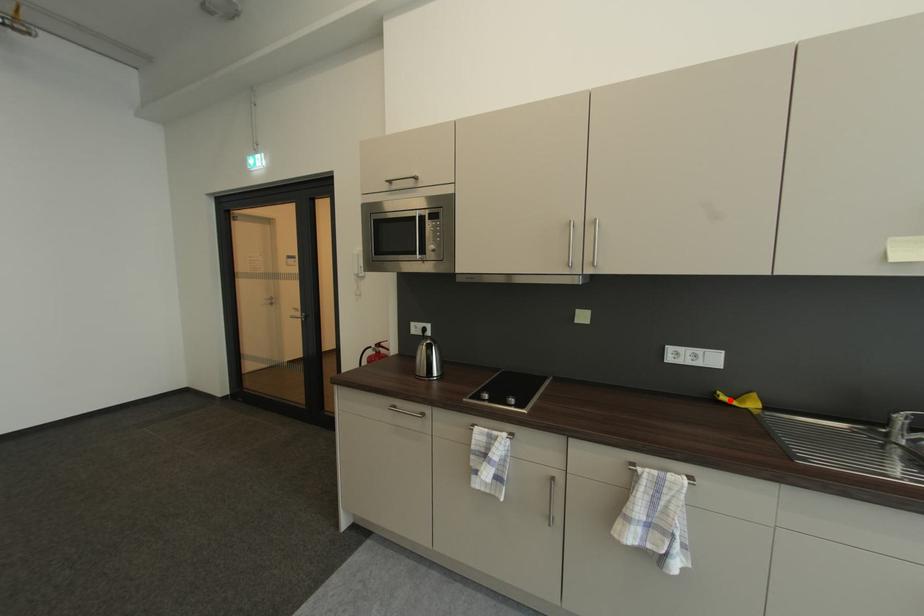
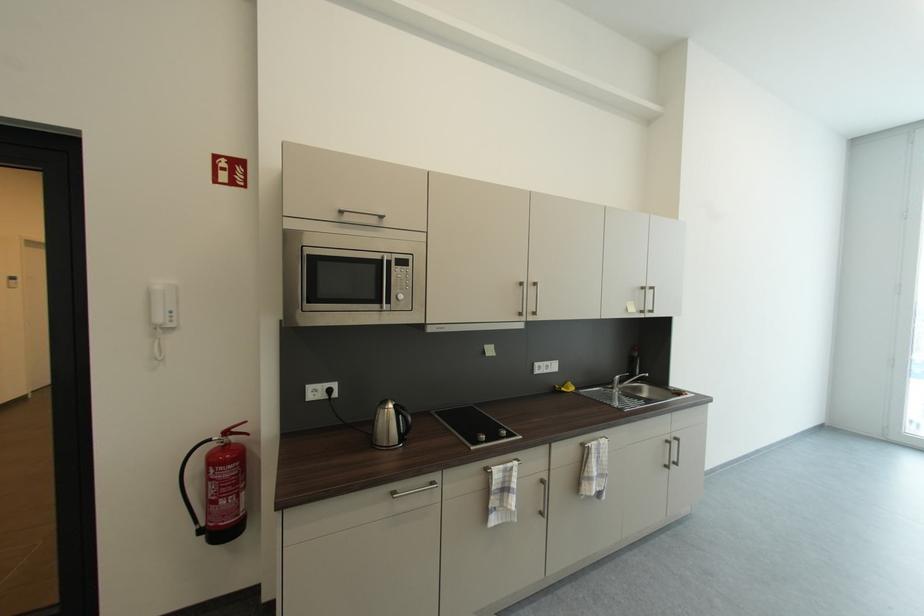
Question: A red point is marked in image1. In image2, is the corresponding 3D point closer to the camera or farther? Reply with the corresponding letter.

Choices:
 (A) The corresponding 3D point is closer.
 (B) The corresponding 3D point is farther.

Answer: (B)